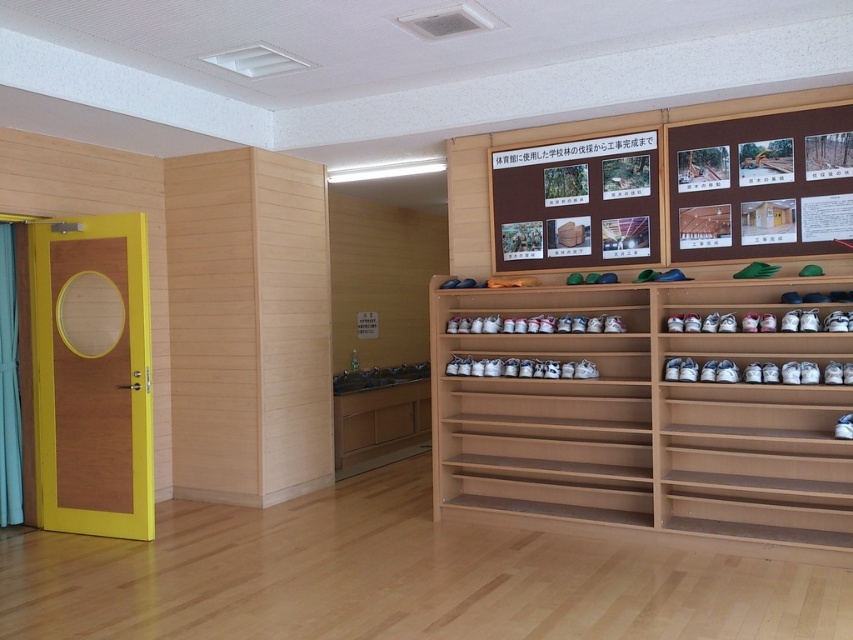
You are organizing a school event and need to hang a large poster. The wooden shoe rack at center and the wooden bulletin board at upper center are both available. Which object is better suited for hanging the poster?

The wooden bulletin board at upper center is better suited for hanging the poster because the wooden shoe rack at center is larger in size but designed for storing shoes, whereas the bulletin board is intended for displaying items like posters.

You are a visitor who just entered the room and wants to place your shoes in the wooden shoe rack at center. The wooden bulletin board at upper center has a notice stating that the rack must be kept at least 40 inches away from the board. Can you safely place your shoes in the rack without violating the rule?

The wooden shoe rack at center is 39.20 inches from the wooden bulletin board at upper center, which is less than the required 40 inches. Therefore, placing shoes in the rack would violate the rule.